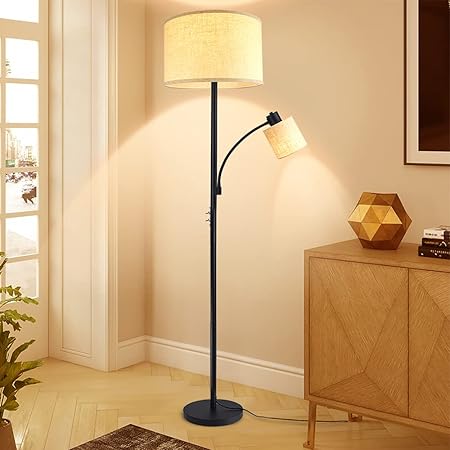
Where is `mat`? The height and width of the screenshot is (450, 450). mat is located at coordinates (143, 440).